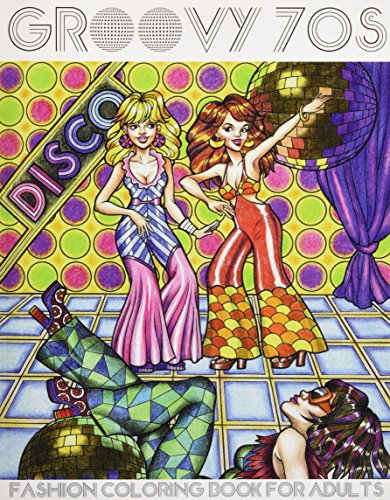
Locate an element on the screen. disco ball is located at coordinates (327, 120).